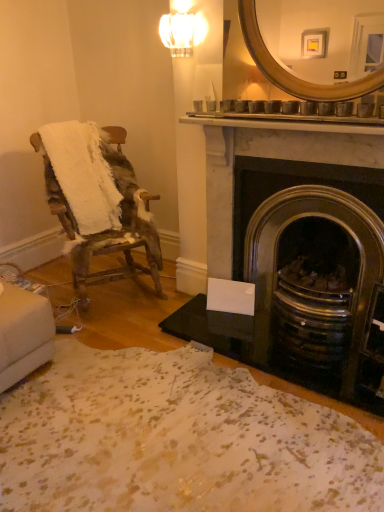
Question: From a real-world perspective, is dark gray stone fireplace at center right beneath worn wood chair at left?

Choices:
 (A) no
 (B) yes

Answer: (A)

Question: Is dark gray stone fireplace at center right smaller than worn wood chair at left?

Choices:
 (A) no
 (B) yes

Answer: (B)

Question: Is dark gray stone fireplace at center right taller than worn wood chair at left?

Choices:
 (A) yes
 (B) no

Answer: (A)

Question: Does dark gray stone fireplace at center right have a lesser width compared to worn wood chair at left?

Choices:
 (A) yes
 (B) no

Answer: (A)

Question: Is dark gray stone fireplace at center right aimed at worn wood chair at left?

Choices:
 (A) yes
 (B) no

Answer: (B)

Question: From the image's perspective, is dark gray stone fireplace at center right located beneath worn wood chair at left?

Choices:
 (A) no
 (B) yes

Answer: (B)

Question: Is clear glass sconce at upper center next to worn wood chair at left?

Choices:
 (A) yes
 (B) no

Answer: (B)

Question: Is clear glass sconce at upper center thinner than worn wood chair at left?

Choices:
 (A) no
 (B) yes

Answer: (B)

Question: Is clear glass sconce at upper center further to the viewer compared to worn wood chair at left?

Choices:
 (A) yes
 (B) no

Answer: (A)

Question: From the image's perspective, is clear glass sconce at upper center located beneath worn wood chair at left?

Choices:
 (A) yes
 (B) no

Answer: (B)

Question: From a real-world perspective, is clear glass sconce at upper center positioned under worn wood chair at left based on gravity?

Choices:
 (A) no
 (B) yes

Answer: (A)

Question: Are clear glass sconce at upper center and worn wood chair at left located far from each other?

Choices:
 (A) no
 (B) yes

Answer: (B)

Question: Can you confirm if gold metallic mirror at upper center is shorter than clear glass sconce at upper center?

Choices:
 (A) yes
 (B) no

Answer: (B)